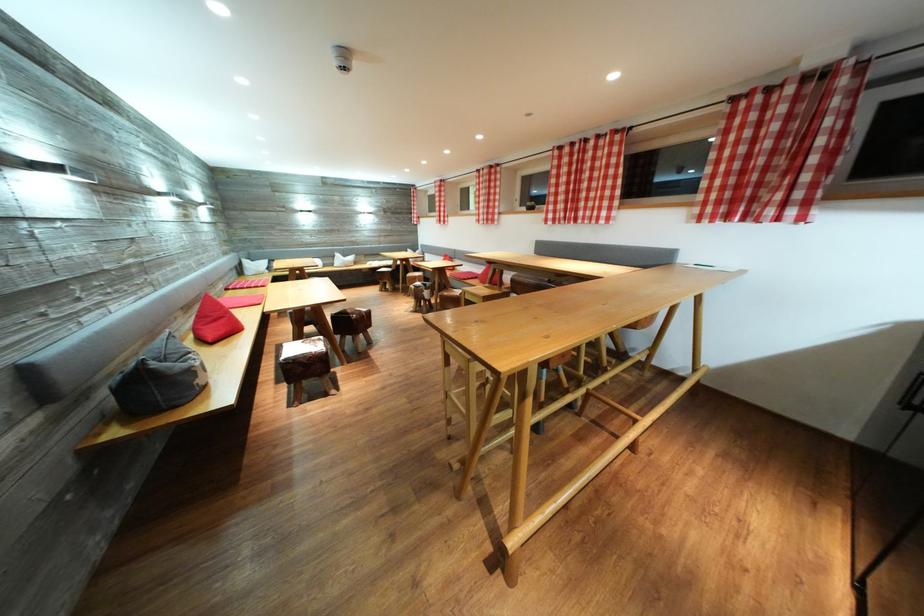
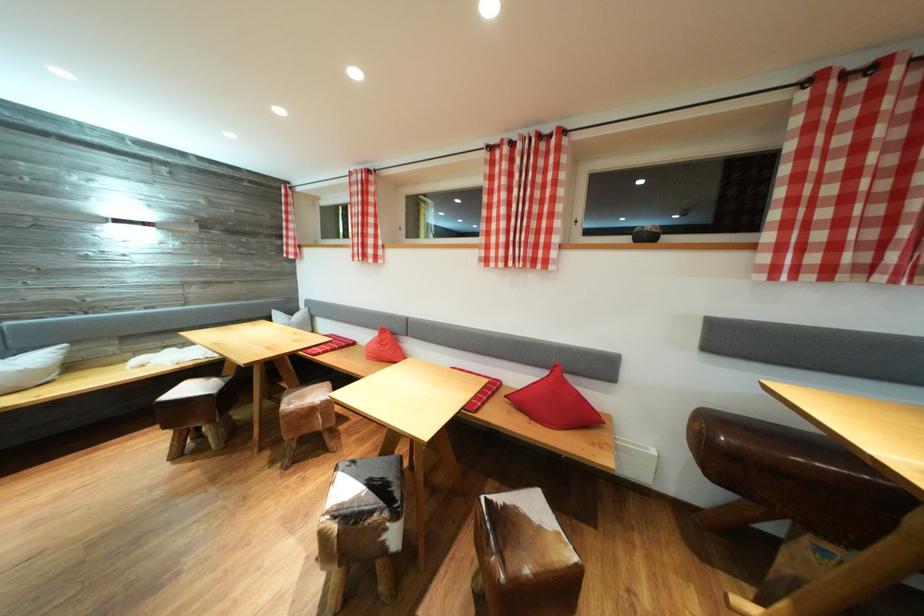
The point at (x=433, y=294) is marked in the first image. Where is the corresponding point in the second image?

(403, 522)